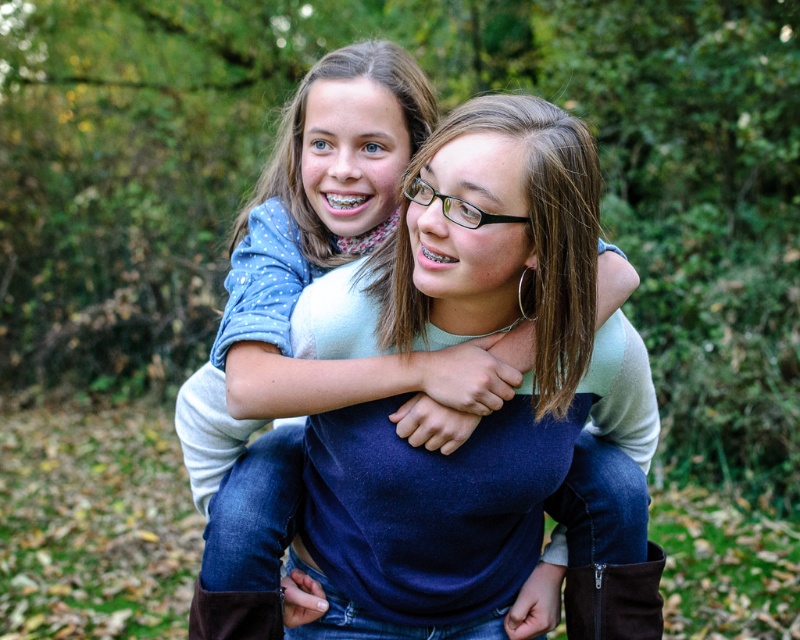
You are standing in the park and see two points in the image. The first point is at coordinates point (310, 184) and the second is at point (632, 573). Which point is closer to you?

Point (310, 184) is closer to the viewer than point (632, 573).

From the picture: You are a photographer trying to capture a photo of the matte blue sweater at center and the brown suede boot at lower right. Since you want to ensure both are in focus, you need to know which object is taller. Can you determine which one is taller?

The matte blue sweater at center is taller than the brown suede boot at lower right according to the description.